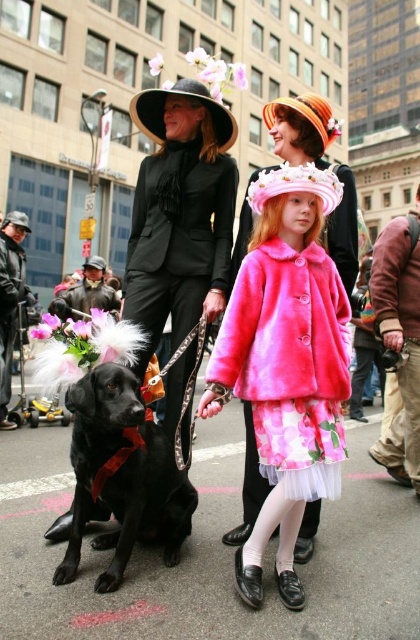
Question: Is matte black suit at center to the right of brown leather jacket at right from the viewer's perspective?

Choices:
 (A) yes
 (B) no

Answer: (B)

Question: Among these objects, which one is nearest to the camera?

Choices:
 (A) shiny black dog at center
 (B) black leather jacket at left

Answer: (A)

Question: Does pink fuzzy coat at center appear on the left side of shiny black dog at center?

Choices:
 (A) yes
 (B) no

Answer: (B)

Question: From the image, what is the correct spatial relationship of pink fuzzy coat at center in relation to leather jacket at center?

Choices:
 (A) left
 (B) right

Answer: (B)

Question: Which object appears closest to the camera in this image?

Choices:
 (A) shiny black dog at center
 (B) brown leather jacket at right
 (C) matte black suit at center

Answer: (A)

Question: Considering the real-world distances, which object is closest to the brown leather jacket at right?

Choices:
 (A) matte black suit at center
 (B) shiny black dog at center
 (C) pink fuzzy coat at center

Answer: (A)